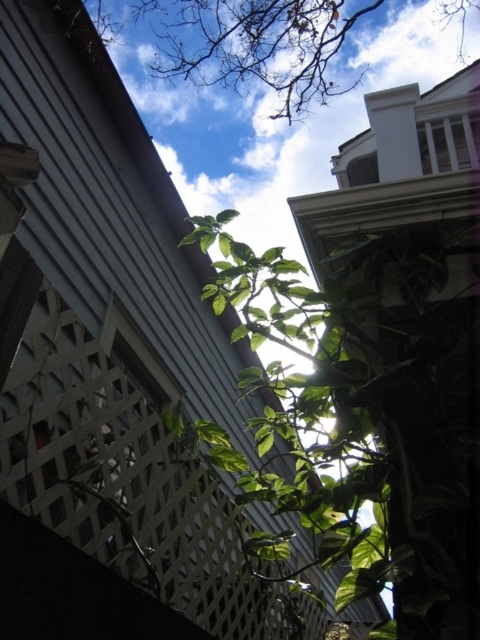
Question: Is white lattice fence at upper center smaller than green leafy plant at upper center?

Choices:
 (A) yes
 (B) no

Answer: (B)

Question: Which point appears closest to the camera in this image?

Choices:
 (A) (165, 458)
 (B) (362, 76)

Answer: (A)

Question: Can you confirm if white lattice fence at upper center is bigger than green leafy plant at upper center?

Choices:
 (A) yes
 (B) no

Answer: (A)

Question: In this image, where is white lattice fence at upper center located relative to green leafy plant at upper center?

Choices:
 (A) left
 (B) right

Answer: (A)

Question: Among these objects, which one is farthest from the camera?

Choices:
 (A) green leafy plant at upper center
 (B) white lattice fence at upper center

Answer: (A)